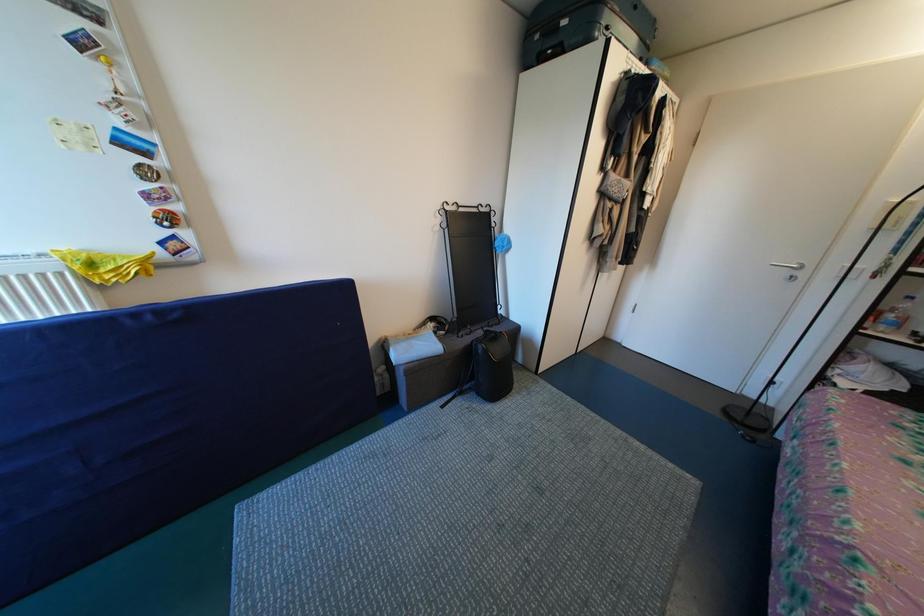
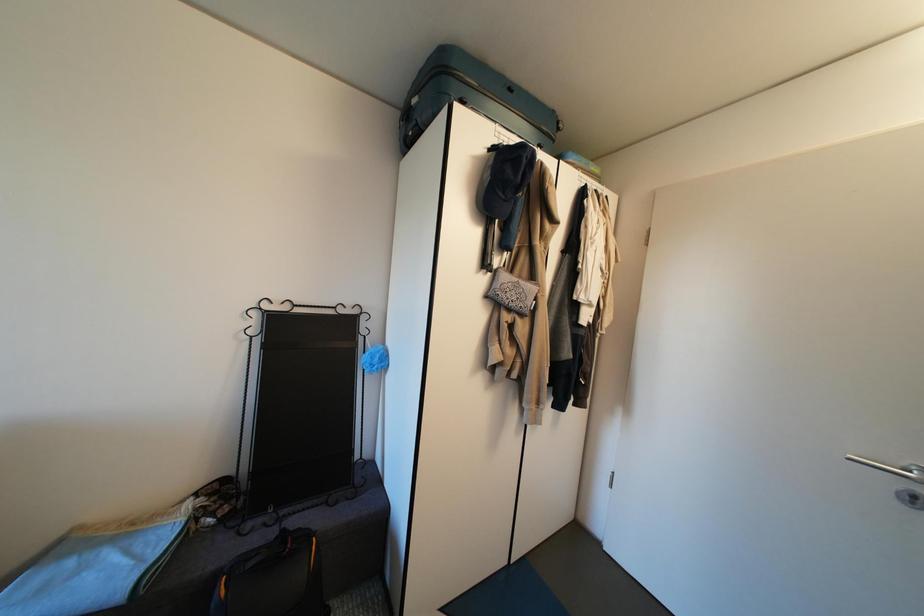
What movement of the cameraman would produce the second image?

The cameraman moved toward right, forward.